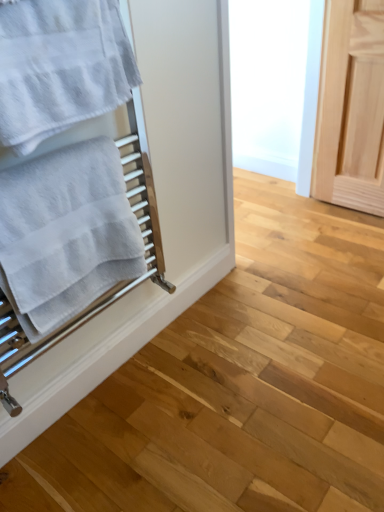
Where is `white cotton towel at left, which is the 1th towel in bottom-to-top order`? This screenshot has width=384, height=512. white cotton towel at left, which is the 1th towel in bottom-to-top order is located at coordinates (65, 233).

This screenshot has height=512, width=384. What do you see at coordinates (65, 233) in the screenshot? I see `white cotton towel at left, which is the 2th towel from top to bottom` at bounding box center [65, 233].

This screenshot has width=384, height=512. Find the location of `white textured towel at left, the 2th towel in the bottom-to-top sequence`. white textured towel at left, the 2th towel in the bottom-to-top sequence is located at coordinates (60, 67).

Describe the element at coordinates (60, 67) in the screenshot. The height and width of the screenshot is (512, 384). I see `white textured towel at left, which ranks as the first towel in top-to-bottom order` at that location.

Where is `white cotton towel at left, which is the 2th towel from top to bottom`? white cotton towel at left, which is the 2th towel from top to bottom is located at coordinates (65, 233).

Based on the photo, which object is positioned more to the left, white cotton towel at left, which is the 2th towel from top to bottom, or white textured towel at left, which ranks as the first towel in top-to-bottom order?

From the viewer's perspective, white cotton towel at left, which is the 2th towel from top to bottom, appears more on the left side.

Which object is further away from the camera, white cotton towel at left, which is the 1th towel in bottom-to-top order, or white textured towel at left, which ranks as the first towel in top-to-bottom order?

white cotton towel at left, which is the 1th towel in bottom-to-top order.

Considering the positions of point (7, 257) and point (79, 19), is point (7, 257) closer or farther from the camera than point (79, 19)?

Point (7, 257) is positioned farther from the camera compared to point (79, 19).

From the image's perspective, which object appears higher, white cotton towel at left, which is the 2th towel from top to bottom, or white textured towel at left, the 2th towel in the bottom-to-top sequence?

white textured towel at left, the 2th towel in the bottom-to-top sequence, from the image's perspective.

From a real-world perspective, who is located lower, white cotton towel at left, which is the 1th towel in bottom-to-top order, or white textured towel at left, the 2th towel in the bottom-to-top sequence?

white cotton towel at left, which is the 1th towel in bottom-to-top order.

Consider the image. Considering the relative sizes of white cotton towel at left, which is the 1th towel in bottom-to-top order, and white textured towel at left, which ranks as the first towel in top-to-bottom order, in the image provided, is white cotton towel at left, which is the 1th towel in bottom-to-top order, thinner than white textured towel at left, which ranks as the first towel in top-to-bottom order,?

No.

Which of these two, white cotton towel at left, which is the 1th towel in bottom-to-top order, or white textured towel at left, the 2th towel in the bottom-to-top sequence, stands shorter?

With less height is white textured towel at left, the 2th towel in the bottom-to-top sequence.

Is white cotton towel at left, which is the 1th towel in bottom-to-top order, smaller than white textured towel at left, the 2th towel in the bottom-to-top sequence?

Actually, white cotton towel at left, which is the 1th towel in bottom-to-top order, might be larger than white textured towel at left, the 2th towel in the bottom-to-top sequence.

Is white cotton towel at left, which is the 1th towel in bottom-to-top order, located outside white textured towel at left, the 2th towel in the bottom-to-top sequence?

Absolutely, white cotton towel at left, which is the 1th towel in bottom-to-top order, is external to white textured towel at left, the 2th towel in the bottom-to-top sequence.

Is white cotton towel at left, which is the 2th towel from top to bottom, far away from white textured towel at left, which ranks as the first towel in top-to-bottom order?

Actually, white cotton towel at left, which is the 2th towel from top to bottom, and white textured towel at left, which ranks as the first towel in top-to-bottom order, are a little close together.

Is white cotton towel at left, which is the 2th towel from top to bottom, facing towards white textured towel at left, the 2th towel in the bottom-to-top sequence?

No, white cotton towel at left, which is the 2th towel from top to bottom, is not turned towards white textured towel at left, the 2th towel in the bottom-to-top sequence.

Measure the distance from white cotton towel at left, which is the 1th towel in bottom-to-top order, to white textured towel at left, the 2th towel in the bottom-to-top sequence.

white cotton towel at left, which is the 1th towel in bottom-to-top order, and white textured towel at left, the 2th towel in the bottom-to-top sequence, are 8.75 inches apart.

The height and width of the screenshot is (512, 384). I want to click on towel in front of the white cotton towel at left, which is the 2th towel from top to bottom, so click(x=60, y=67).

Does white textured towel at left, which ranks as the first towel in top-to-bottom order, appear on the left side of white cotton towel at left, which is the 2th towel from top to bottom?

No, white textured towel at left, which ranks as the first towel in top-to-bottom order, is not to the left of white cotton towel at left, which is the 2th towel from top to bottom.

Does white textured towel at left, the 2th towel in the bottom-to-top sequence, come behind white cotton towel at left, which is the 2th towel from top to bottom?

No, it is not.

Is point (113, 45) closer or farther from the camera than point (57, 212)?

Point (113, 45) appears to be closer to the viewer than point (57, 212).

From the image's perspective, relative to white cotton towel at left, which is the 1th towel in bottom-to-top order, is white textured towel at left, the 2th towel in the bottom-to-top sequence, above or below?

Clearly, from the image's perspective, white textured towel at left, the 2th towel in the bottom-to-top sequence, is above white cotton towel at left, which is the 1th towel in bottom-to-top order.

From a real-world perspective, is white textured towel at left, the 2th towel in the bottom-to-top sequence, over white cotton towel at left, which is the 2th towel from top to bottom?

Yes, from a real-world perspective, white textured towel at left, the 2th towel in the bottom-to-top sequence, is over white cotton towel at left, which is the 2th towel from top to bottom

Is white textured towel at left, which ranks as the first towel in top-to-bottom order, wider or thinner than white cotton towel at left, which is the 1th towel in bottom-to-top order?

Clearly, white textured towel at left, which ranks as the first towel in top-to-bottom order, has less width compared to white cotton towel at left, which is the 1th towel in bottom-to-top order.

Which of these two, white textured towel at left, the 2th towel in the bottom-to-top sequence, or white cotton towel at left, which is the 2th towel from top to bottom, stands taller?

With more height is white cotton towel at left, which is the 2th towel from top to bottom.

Which of these two, white textured towel at left, which ranks as the first towel in top-to-bottom order, or white cotton towel at left, which is the 2th towel from top to bottom, is smaller?

white textured towel at left, which ranks as the first towel in top-to-bottom order, is smaller.

Is white cotton towel at left, which is the 2th towel from top to bottom, completely or partially inside white textured towel at left, the 2th towel in the bottom-to-top sequence?

No, white cotton towel at left, which is the 2th towel from top to bottom, is not a part of white textured towel at left, the 2th towel in the bottom-to-top sequence.

Is white textured towel at left, the 2th towel in the bottom-to-top sequence, far away from white cotton towel at left, which is the 2th towel from top to bottom?

white textured towel at left, the 2th towel in the bottom-to-top sequence, is actually quite close to white cotton towel at left, which is the 2th towel from top to bottom.

Is white textured towel at left, which ranks as the first towel in top-to-bottom order, looking in the opposite direction of white cotton towel at left, which is the 2th towel from top to bottom?

No, white textured towel at left, which ranks as the first towel in top-to-bottom order, is not facing away from white cotton towel at left, which is the 2th towel from top to bottom.

Locate an element on the screen. towel above the white cotton towel at left, which is the 2th towel from top to bottom (from the image's perspective) is located at coordinates (60, 67).

Locate an element on the screen. The width and height of the screenshot is (384, 512). towel to the right of white cotton towel at left, which is the 1th towel in bottom-to-top order is located at coordinates (60, 67).

Locate an element on the screen. The image size is (384, 512). towel that appears below the white textured towel at left, which ranks as the first towel in top-to-bottom order (from the image's perspective) is located at coordinates (65, 233).